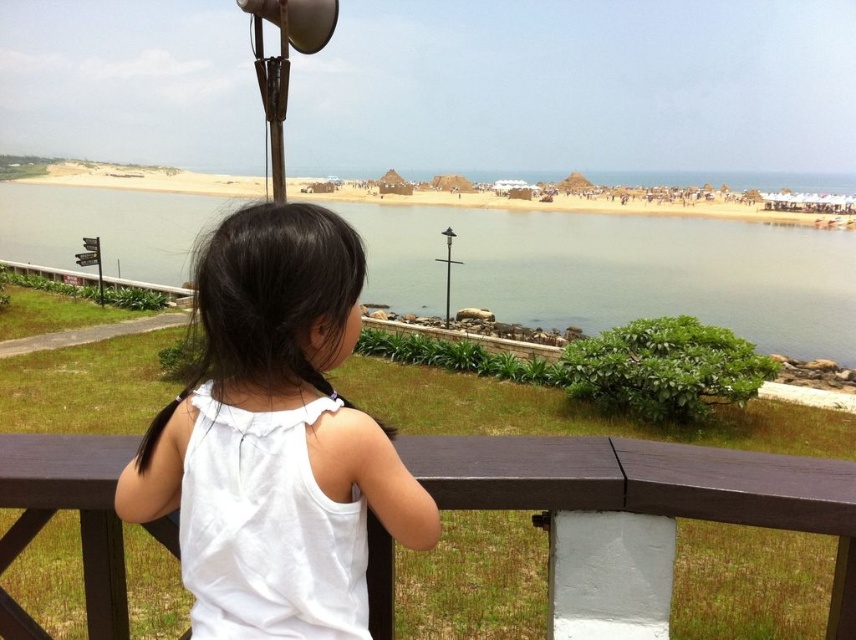
Which of these two, white cotton shirt at center or sandy beach at center, stands shorter?

white cotton shirt at center is shorter.

Between white cotton shirt at center and sandy beach at center, which one is positioned lower?

white cotton shirt at center is lower down.

Who is more distant from viewer, (135, 456) or (718, 209)?

The point (718, 209) is more distant.

The width and height of the screenshot is (856, 640). Identify the location of white cotton shirt at center. (275, 385).

Is white cotton shirt at center further to the viewer compared to brown wooden balustrade at center?

That is False.

Which is in front, point (239, 392) or point (783, 474)?

Point (239, 392) is more forward.

I want to click on white cotton shirt at center, so click(275, 385).

Which is below, clear blue water at center or brown wooden balustrade at center?

Positioned lower is brown wooden balustrade at center.

From the picture: Which is more to the right, clear blue water at center or brown wooden balustrade at center?

brown wooden balustrade at center

Who is more forward, [583,300] or [126,605]?

Positioned in front is point [126,605].

The height and width of the screenshot is (640, 856). I want to click on clear blue water at center, so click(617, 269).